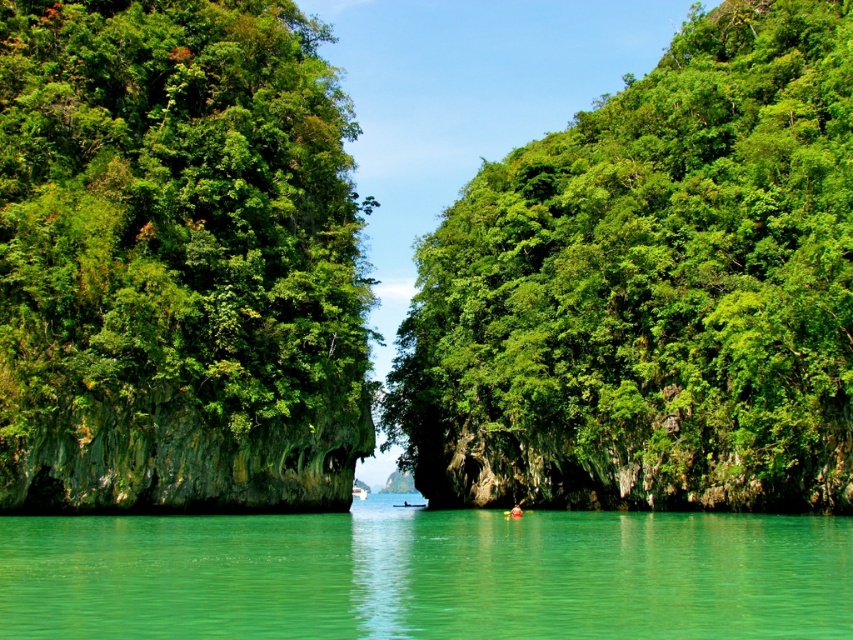
Question: Is green leafy tree at left to the left of clear water at center from the viewer's perspective?

Choices:
 (A) yes
 (B) no

Answer: (A)

Question: Which point appears closest to the camera in this image?

Choices:
 (A) (93, 380)
 (B) (529, 170)

Answer: (A)

Question: From the image, what is the correct spatial relationship of green leafy tree at left in relation to clear water at center?

Choices:
 (A) above
 (B) below

Answer: (A)

Question: Can you confirm if green leafy tree at center is positioned above green leafy tree at left?

Choices:
 (A) yes
 (B) no

Answer: (B)

Question: Which point is farther to the camera?

Choices:
 (A) (705, 550)
 (B) (729, 195)

Answer: (B)

Question: Which object appears farthest from the camera in this image?

Choices:
 (A) green leafy tree at left
 (B) green leafy tree at center
 (C) clear water at center

Answer: (B)